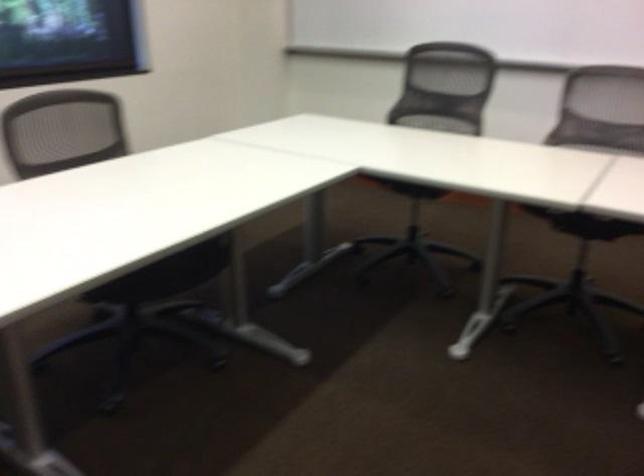
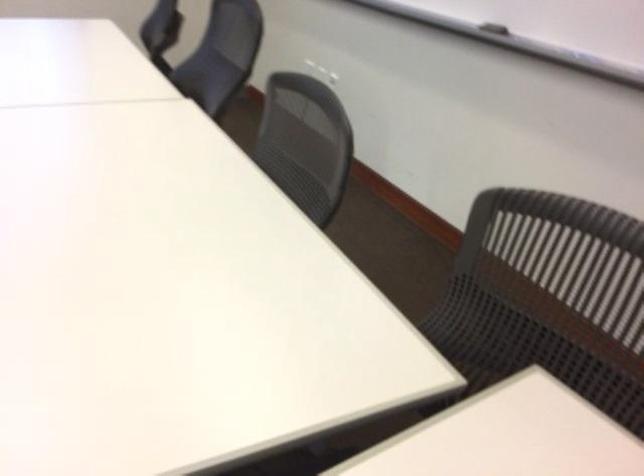
Question: The images are taken continuously from a first-person perspective. In which direction are you moving?

Choices:
 (A) Left
 (B) Right
 (C) Forward
 (D) Backward

Answer: (B)